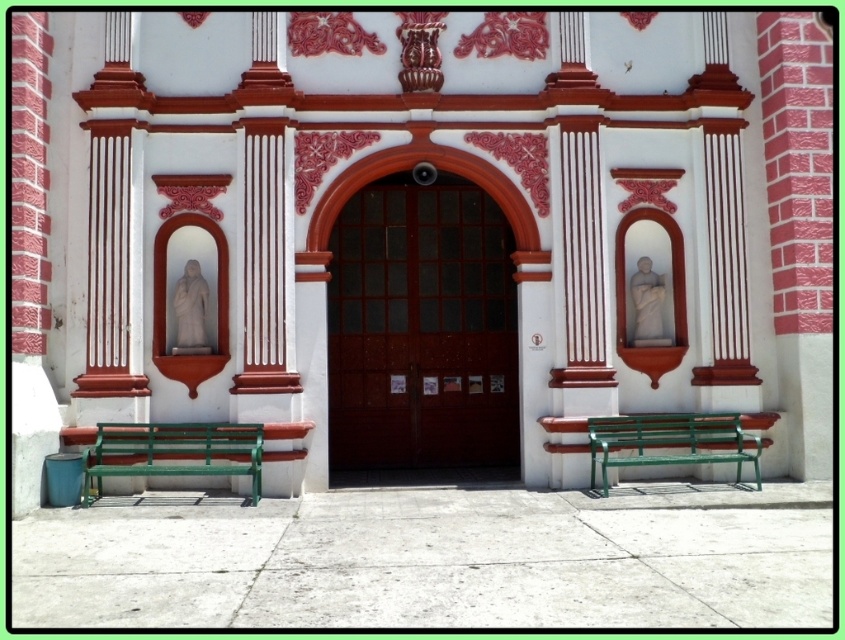
Question: Can you confirm if green painted wood bench at lower left is wider than green metal bench at lower right?

Choices:
 (A) yes
 (B) no

Answer: (B)

Question: Is the position of green painted wood bench at lower left more distant than that of green metal bench at lower right?

Choices:
 (A) yes
 (B) no

Answer: (B)

Question: Does green painted wood bench at lower left have a larger size compared to green metal bench at lower right?

Choices:
 (A) no
 (B) yes

Answer: (A)

Question: Among these objects, which one is farthest from the camera?

Choices:
 (A) green painted wood bench at lower left
 (B) green metal bench at lower right

Answer: (B)